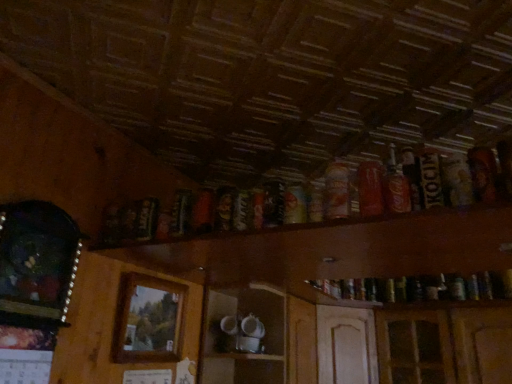
How much space does wooden picture frame at left, which ranks as the first picture frame in left-to-right order, occupy horizontally?

It is 2.32 inches.

Measure the distance between matte orange can at upper center, the fourth beer in the right-to-left sequence, and camera.

matte orange can at upper center, the fourth beer in the right-to-left sequence, is 3.58 feet away from camera.

In order to click on dark brown glass bottle at upper center, the 6th beer positioned from the right in this screenshot , I will do [x=273, y=203].

Is wooden picture frame at left, the 1th picture frame in the front-to-back sequence, thinner than shiny metallic can at upper center, the 4th beer from the left?

Yes, wooden picture frame at left, the 1th picture frame in the front-to-back sequence, is thinner than shiny metallic can at upper center, the 4th beer from the left.

From their relative heights in the image, would you say wooden picture frame at left, the 1th picture frame in the front-to-back sequence, is taller or shorter than shiny metallic can at upper center, the 4th beer from the left?

wooden picture frame at left, the 1th picture frame in the front-to-back sequence, is taller than shiny metallic can at upper center, the 4th beer from the left.

From a real-world perspective, relative to shiny metallic can at upper center, the 4th beer from the left, is wooden picture frame at left, which ranks as the first picture frame in left-to-right order, vertically above or below?

In terms of real-world spatial position, wooden picture frame at left, which ranks as the first picture frame in left-to-right order, is below shiny metallic can at upper center, the 4th beer from the left.

Can you confirm if wooden picture frame at left, the 1th picture frame in the front-to-back sequence, is smaller than shiny metallic can at upper center, the 5th beer viewed from the right?

No.

From a real-world perspective, who is located higher, white glossy cups at center or wooden shelf at upper center?

In real-world perspective, wooden shelf at upper center is above.

Considering the points (225, 382) and (366, 257), which point is in front, point (225, 382) or point (366, 257)?

The point (366, 257) is closer to the camera.

Considering the sizes of objects white glossy cups at center and wooden shelf at upper center in the image provided, who is bigger, white glossy cups at center or wooden shelf at upper center?

Bigger between the two is wooden shelf at upper center.

Would you consider white glossy cups at center to be distant from wooden shelf at upper center?

No, there isn't a large distance between white glossy cups at center and wooden shelf at upper center.

Is matte black can at center, marked as the 7th beer in a right-to-left arrangement, oriented towards matte red can at upper right, which ranks as the sixth beer in left-to-right order?

No, matte black can at center, marked as the 7th beer in a right-to-left arrangement, does not turn towards matte red can at upper right, which ranks as the sixth beer in left-to-right order.

Can you see matte black can at center, the second beer positioned from the left, touching matte red can at upper right, which ranks as the sixth beer in left-to-right order?

No, matte black can at center, the second beer positioned from the left, is not touching matte red can at upper right, which ranks as the sixth beer in left-to-right order.

Is matte black can at center, marked as the 7th beer in a right-to-left arrangement, smaller than matte red can at upper right, which ranks as the sixth beer in left-to-right order?

Correct, matte black can at center, marked as the 7th beer in a right-to-left arrangement, occupies less space than matte red can at upper right, which ranks as the sixth beer in left-to-right order.

Is matte orange can at upper center, the fourth beer in the right-to-left sequence, at the back of wooden frame at center, placed as the 1th picture frame when sorted from back to front?

No, wooden frame at center, placed as the 1th picture frame when sorted from back to front,'s orientation is not away from matte orange can at upper center, the fourth beer in the right-to-left sequence.

How many degrees apart are the facing directions of wooden frame at center, placed as the 1th picture frame when sorted from back to front, and matte orange can at upper center, the fourth beer in the right-to-left sequence?

The facing directions of wooden frame at center, placed as the 1th picture frame when sorted from back to front, and matte orange can at upper center, the fourth beer in the right-to-left sequence, are 89.4 degrees apart.

From a real-world perspective, count 2nd picture frames downward from the matte orange can at upper center, the fourth beer in the right-to-left sequence, and point to it. Please provide its 2D coordinates.

[(148, 320)]

From the image's perspective, is wooden frame at center, which appears as the 2th picture frame when viewed from the left, located above or below matte orange can at upper center, the 5th beer positioned from the left?

Based on their image positions, wooden frame at center, which appears as the 2th picture frame when viewed from the left, is located beneath matte orange can at upper center, the 5th beer positioned from the left.

Consider the image. Could you measure the distance between dark brown glass bottle at left, positioned as the eighth beer in right-to-left order, and dark brown glass bottle at upper center, arranged as the third beer when viewed from the left?

16.74 inches.

Relative to dark brown glass bottle at upper center, arranged as the third beer when viewed from the left, is dark brown glass bottle at left, positioned as the eighth beer in right-to-left order, in front or behind?

dark brown glass bottle at left, positioned as the eighth beer in right-to-left order, is behind dark brown glass bottle at upper center, arranged as the third beer when viewed from the left.

Is dark brown glass bottle at left, positioned as the eighth beer in right-to-left order, next to dark brown glass bottle at upper center, the 6th beer positioned from the right?

No, dark brown glass bottle at left, positioned as the eighth beer in right-to-left order, is not next to dark brown glass bottle at upper center, the 6th beer positioned from the right.

Is point (143, 240) in front of point (271, 221)?

No.

From the image's perspective, is matte orange can at upper center, the fourth beer in the right-to-left sequence, on top of wooden picture frame at left, positioned as the 2th picture frame in back-to-front order?

Indeed, from the image's perspective, matte orange can at upper center, the fourth beer in the right-to-left sequence, is shown above wooden picture frame at left, positioned as the 2th picture frame in back-to-front order.

Is matte orange can at upper center, the fourth beer in the right-to-left sequence, taller or shorter than wooden picture frame at left, the 1th picture frame in the front-to-back sequence?

In the image, matte orange can at upper center, the fourth beer in the right-to-left sequence, appears to be shorter than wooden picture frame at left, the 1th picture frame in the front-to-back sequence.

Is matte orange can at upper center, the fourth beer in the right-to-left sequence, touching wooden picture frame at left, which is the second picture frame in right-to-left order?

matte orange can at upper center, the fourth beer in the right-to-left sequence, and wooden picture frame at left, which is the second picture frame in right-to-left order, are clearly separated.

Can wooden picture frame at left, positioned as the 2th picture frame in back-to-front order, be found inside matte orange can at upper center, the fourth beer in the right-to-left sequence?

No.

Is wooden picture frame at left, the 1th picture frame in the front-to-back sequence, behind matte red can at upper right, which ranks as the sixth beer in left-to-right order?

No, it is not.

Is wooden picture frame at left, which is the second picture frame in right-to-left order, oriented towards matte red can at upper right, which ranks as the sixth beer in left-to-right order?

Yes, wooden picture frame at left, which is the second picture frame in right-to-left order, is oriented towards matte red can at upper right, which ranks as the sixth beer in left-to-right order.

Looking at this image, does wooden picture frame at left, positioned as the 2th picture frame in back-to-front order, have a greater width compared to matte red can at upper right, which ranks as the sixth beer in left-to-right order?

Incorrect, the width of wooden picture frame at left, positioned as the 2th picture frame in back-to-front order, does not surpass that of matte red can at upper right, which ranks as the sixth beer in left-to-right order.

The width and height of the screenshot is (512, 384). In order to click on picture frame in front of the matte red can at upper right, the 3th beer when ordered from right to left in this screenshot , I will do `click(37, 259)`.

From a real-world perspective, starting from the shiny metallic can at upper center, the 4th beer from the left, which picture frame is the 1st one below it? Please provide its 2D coordinates.

[(37, 259)]

Image resolution: width=512 pixels, height=384 pixels. Identify the location of dresser that appears in front of the white glossy cups at center. (307, 299).

From the image, which object appears to be nearer to wooden shelf at upper center, dark brown glass bottle at left, positioned as the eighth beer in right-to-left order, or matte orange can at upper center, the fourth beer in the right-to-left sequence?

Based on the image, dark brown glass bottle at left, positioned as the eighth beer in right-to-left order, appears to be nearer to wooden shelf at upper center.

Which object lies nearer to the anchor point wooden frame at center, placed as the 1th picture frame when sorted from back to front, dark brown cardboard beer can at upper right, placed as the 1th beer when sorted from right to left, or matte black can at center, the second beer positioned from the left?

matte black can at center, the second beer positioned from the left, lies closer to wooden frame at center, placed as the 1th picture frame when sorted from back to front, than the other object.

Based on the photo, estimate the real-world distances between objects in this image. Which object is closer to white glossy cups at center, matte black can at center, the second beer positioned from the left, or matte orange can at upper center, the fourth beer in the right-to-left sequence?

matte black can at center, the second beer positioned from the left, is closer to white glossy cups at center.

Which object lies nearer to the anchor point wooden shelf at upper center, wooden picture frame at left, positioned as the 2th picture frame in back-to-front order, or matte red can at upper right, which ranks as the sixth beer in left-to-right order?

wooden picture frame at left, positioned as the 2th picture frame in back-to-front order.

When comparing their distances from matte red can at upper right, positioned as the second beer in right-to-left order, does wooden picture frame at left, the 1th picture frame in the front-to-back sequence, or dark brown glass bottle at upper center, the 6th beer positioned from the right, seem further?

The object further to matte red can at upper right, positioned as the second beer in right-to-left order, is wooden picture frame at left, the 1th picture frame in the front-to-back sequence.

When comparing their distances from wooden frame at center, which is the 2th picture frame from front to back, does wooden shelf at upper center or wooden picture frame at left, which is the second picture frame in right-to-left order, seem further?

wooden shelf at upper center is positioned further to the anchor wooden frame at center, which is the 2th picture frame from front to back.

Which object lies nearer to the anchor point dark brown glass bottle at upper center, the 6th beer positioned from the right, matte red can at upper right, which ranks as the 7th beer in left-to-right order, or wooden frame at center, which appears as the 2th picture frame when viewed from the left?

The object closer to dark brown glass bottle at upper center, the 6th beer positioned from the right, is matte red can at upper right, which ranks as the 7th beer in left-to-right order.

Based on their spatial positions, is matte orange can at upper center, the 5th beer positioned from the left, or white glossy cups at center closer to dark brown glass bottle at left, positioned as the eighth beer in right-to-left order?

matte orange can at upper center, the 5th beer positioned from the left, is positioned closer to the anchor dark brown glass bottle at left, positioned as the eighth beer in right-to-left order.

The image size is (512, 384). Identify the location of picture frame situated between wooden picture frame at left, positioned as the 2th picture frame in back-to-front order, and wooden shelf at upper center from left to right. (148, 320).

In order to click on beer that lies between matte black can at center, marked as the 7th beer in a right-to-left arrangement, and white glossy cups at center from top to bottom in this screenshot , I will do `click(147, 219)`.

Where is `beer situated between dark brown glass bottle at upper center, the 6th beer positioned from the right, and matte orange can at upper center, the fourth beer in the right-to-left sequence, from left to right`? beer situated between dark brown glass bottle at upper center, the 6th beer positioned from the right, and matte orange can at upper center, the fourth beer in the right-to-left sequence, from left to right is located at coordinates (295, 205).

Where is `shelf between wooden picture frame at left, the 1th picture frame in the front-to-back sequence, and matte orange can at upper center, the fourth beer in the right-to-left sequence, from left to right`? shelf between wooden picture frame at left, the 1th picture frame in the front-to-back sequence, and matte orange can at upper center, the fourth beer in the right-to-left sequence, from left to right is located at coordinates (244, 336).